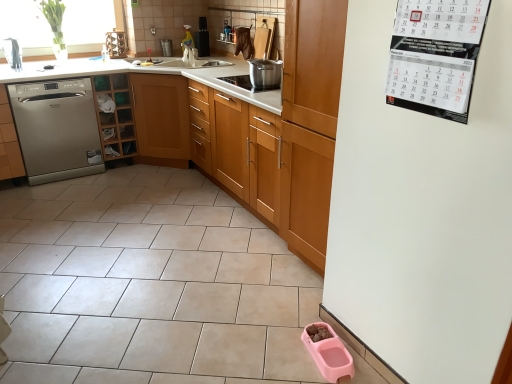
Identify the location of vacant space underneath pink plastic pet food bowl at lower right (from a real-world perspective). (327, 358).